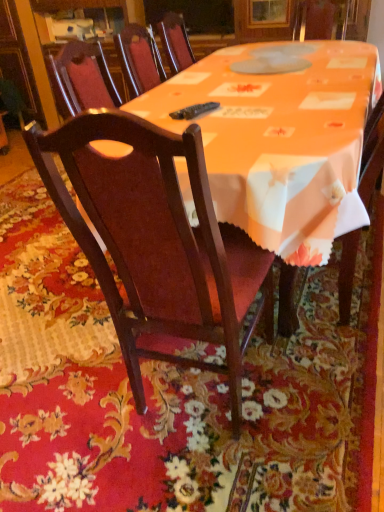
Question: From the image's perspective, is mahogany wood chair at center on glossy wood cabinet at upper left?

Choices:
 (A) yes
 (B) no

Answer: (B)

Question: Considering the relative positions of mahogany wood chair at center and glossy wood cabinet at upper left in the image provided, is mahogany wood chair at center to the right of glossy wood cabinet at upper left from the viewer's perspective?

Choices:
 (A) yes
 (B) no

Answer: (A)

Question: Is mahogany wood chair at center not inside glossy wood cabinet at upper left?

Choices:
 (A) no
 (B) yes

Answer: (B)

Question: From a real-world perspective, is mahogany wood chair at center beneath glossy wood cabinet at upper left?

Choices:
 (A) yes
 (B) no

Answer: (A)

Question: From a real-world perspective, does mahogany wood chair at center stand above glossy wood cabinet at upper left?

Choices:
 (A) yes
 (B) no

Answer: (B)

Question: Is mahogany wood chair at center next to glossy wood cabinet at upper left and touching it?

Choices:
 (A) no
 (B) yes

Answer: (A)

Question: Is glossy wood cabinet at upper left touching mahogany wood chair at center?

Choices:
 (A) no
 (B) yes

Answer: (A)

Question: Does glossy wood cabinet at upper left have a smaller size compared to mahogany wood chair at center?

Choices:
 (A) yes
 (B) no

Answer: (B)

Question: Is glossy wood cabinet at upper left positioned behind mahogany wood chair at center?

Choices:
 (A) no
 (B) yes

Answer: (B)

Question: Is glossy wood cabinet at upper left oriented away from mahogany wood chair at center?

Choices:
 (A) yes
 (B) no

Answer: (B)

Question: Considering the relative sizes of glossy wood cabinet at upper left and mahogany wood chair at center in the image provided, is glossy wood cabinet at upper left thinner than mahogany wood chair at center?

Choices:
 (A) yes
 (B) no

Answer: (B)

Question: Is glossy wood cabinet at upper left facing towards mahogany wood chair at center?

Choices:
 (A) yes
 (B) no

Answer: (B)

Question: In terms of size, does glossy wood cabinet at upper left appear bigger or smaller than mahogany wood chair at center?

Choices:
 (A) small
 (B) big

Answer: (B)